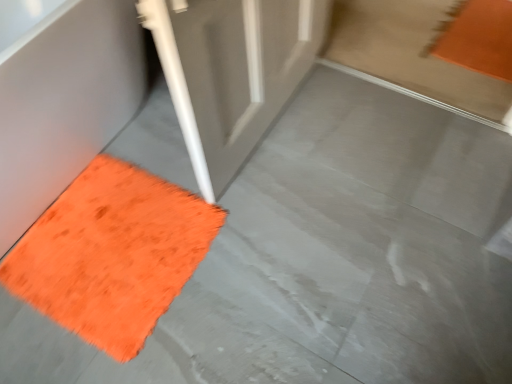
Describe the element at coordinates (64, 103) in the screenshot. Image resolution: width=512 pixels, height=384 pixels. I see `orange shaggy bath mat at lower left` at that location.

This screenshot has width=512, height=384. What are the coordinates of `orange shaggy bath mat at lower left` in the screenshot? It's located at (64, 103).

Where is `orange fuzzy mat at lower left`? This screenshot has height=384, width=512. orange fuzzy mat at lower left is located at coordinates (112, 254).

The width and height of the screenshot is (512, 384). Describe the element at coordinates (112, 254) in the screenshot. I see `orange fuzzy mat at lower left` at that location.

Where is `orange shaggy bath mat at lower left`? orange shaggy bath mat at lower left is located at coordinates (64, 103).

Considering the relative positions of orange shaggy bath mat at lower left and orange fuzzy mat at lower left in the image provided, is orange shaggy bath mat at lower left to the left or to the right of orange fuzzy mat at lower left?

Based on their positions, orange shaggy bath mat at lower left is located to the left of orange fuzzy mat at lower left.

Considering the relative positions of orange shaggy bath mat at lower left and orange fuzzy mat at lower left in the image provided, is orange shaggy bath mat at lower left in front of orange fuzzy mat at lower left?

Yes, orange shaggy bath mat at lower left is in front of orange fuzzy mat at lower left.

Does point (72, 78) come behind point (169, 205)?

No, (72, 78) is closer to viewer.

Consider the image. From the image's perspective, would you say orange shaggy bath mat at lower left is positioned over orange fuzzy mat at lower left?

Yes, from the image's perspective, orange shaggy bath mat at lower left is on top of orange fuzzy mat at lower left.

From a real-world perspective, is orange shaggy bath mat at lower left positioned above or below orange fuzzy mat at lower left?

Clearly, from a real-world perspective, orange shaggy bath mat at lower left is above orange fuzzy mat at lower left.

Is orange shaggy bath mat at lower left wider or thinner than orange fuzzy mat at lower left?

Considering their sizes, orange shaggy bath mat at lower left looks broader than orange fuzzy mat at lower left.

Is orange shaggy bath mat at lower left taller than orange fuzzy mat at lower left?

Yes.

Which of these two, orange shaggy bath mat at lower left or orange fuzzy mat at lower left, is bigger?

With larger size is orange shaggy bath mat at lower left.

Do you think orange shaggy bath mat at lower left is within orange fuzzy mat at lower left, or outside of it?

orange shaggy bath mat at lower left is located beyond the bounds of orange fuzzy mat at lower left.

Are orange shaggy bath mat at lower left and orange fuzzy mat at lower left making contact?

There is a gap between orange shaggy bath mat at lower left and orange fuzzy mat at lower left.

Is orange shaggy bath mat at lower left turned away from orange fuzzy mat at lower left?

That's not correct — orange shaggy bath mat at lower left is not looking away from orange fuzzy mat at lower left.

How many degrees apart are the facing directions of orange shaggy bath mat at lower left and orange fuzzy mat at lower left?

There is a 0.000537-degree angle between the facing directions of orange shaggy bath mat at lower left and orange fuzzy mat at lower left.

Measure the distance between orange shaggy bath mat at lower left and orange fuzzy mat at lower left.

orange shaggy bath mat at lower left and orange fuzzy mat at lower left are 31.01 centimeters apart.

Where is `bath in front of the orange fuzzy mat at lower left`? The width and height of the screenshot is (512, 384). bath in front of the orange fuzzy mat at lower left is located at coordinates (64, 103).

Which object is positioned more to the left, orange fuzzy mat at lower left or orange shaggy bath mat at lower left?

orange shaggy bath mat at lower left is more to the left.

In the image, is orange fuzzy mat at lower left positioned in front of or behind orange shaggy bath mat at lower left?

Visually, orange fuzzy mat at lower left is located behind orange shaggy bath mat at lower left.

Which is nearer, (131,202) or (25,183)?

Clearly, point (131,202) is more distant from the camera than point (25,183).

From the image's perspective, between orange fuzzy mat at lower left and orange shaggy bath mat at lower left, who is located below?

orange fuzzy mat at lower left appears lower in the image.

From a real-world perspective, between orange fuzzy mat at lower left and orange shaggy bath mat at lower left, who is vertically lower?

orange fuzzy mat at lower left.

In the scene shown: Which object is thinner, orange fuzzy mat at lower left or orange shaggy bath mat at lower left?

orange fuzzy mat at lower left is thinner.

Can you confirm if orange fuzzy mat at lower left is taller than orange shaggy bath mat at lower left?

No, orange fuzzy mat at lower left is not taller than orange shaggy bath mat at lower left.

Looking at the image, does orange fuzzy mat at lower left seem bigger or smaller compared to orange shaggy bath mat at lower left?

orange fuzzy mat at lower left is smaller than orange shaggy bath mat at lower left.

Is orange shaggy bath mat at lower left completely or partially inside orange fuzzy mat at lower left?

No, orange shaggy bath mat at lower left is not a part of orange fuzzy mat at lower left.

Is orange fuzzy mat at lower left far from orange shaggy bath mat at lower left?

They are positioned close to each other.

Is orange fuzzy mat at lower left positioned with its back to orange shaggy bath mat at lower left?

No.

Can you tell me how much orange fuzzy mat at lower left and orange shaggy bath mat at lower left differ in facing direction?

They differ by 0.000537 degrees in their facing directions.

I want to click on mat below the orange shaggy bath mat at lower left (from a real-world perspective), so click(x=112, y=254).

Where is `bath that appears above the orange fuzzy mat at lower left (from a real-world perspective)`? bath that appears above the orange fuzzy mat at lower left (from a real-world perspective) is located at coordinates (64, 103).

Locate an element on the screen. mat behind the orange shaggy bath mat at lower left is located at coordinates (112, 254).